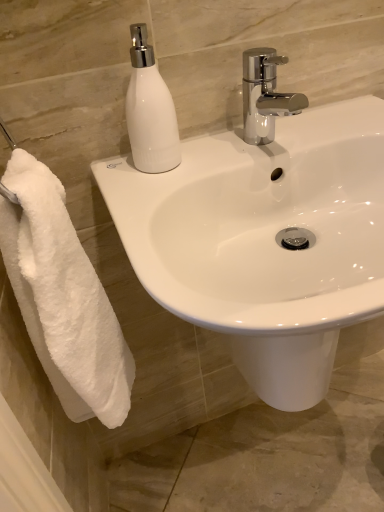
Question: Can white fluffy towel at left be found inside white glossy soap dispenser at upper left?

Choices:
 (A) no
 (B) yes

Answer: (A)

Question: Is white glossy soap dispenser at upper left thinner than white fluffy towel at left?

Choices:
 (A) no
 (B) yes

Answer: (B)

Question: Can you see white glossy soap dispenser at upper left touching white fluffy towel at left?

Choices:
 (A) yes
 (B) no

Answer: (B)

Question: Is white glossy soap dispenser at upper left aimed at white fluffy towel at left?

Choices:
 (A) no
 (B) yes

Answer: (A)

Question: Can you confirm if white glossy soap dispenser at upper left is shorter than white fluffy towel at left?

Choices:
 (A) no
 (B) yes

Answer: (B)

Question: Does point (127, 109) appear closer or farther from the camera than point (271, 48)?

Choices:
 (A) closer
 (B) farther

Answer: (A)

Question: Relative to chrome metallic faucet at upper center, is white glossy soap dispenser at upper left in front or behind?

Choices:
 (A) behind
 (B) front

Answer: (B)

Question: Considering the positions of white glossy soap dispenser at upper left and chrome metallic faucet at upper center in the image, is white glossy soap dispenser at upper left wider or thinner than chrome metallic faucet at upper center?

Choices:
 (A) wide
 (B) thin

Answer: (B)

Question: Looking at the image, does white glossy soap dispenser at upper left seem bigger or smaller compared to chrome metallic faucet at upper center?

Choices:
 (A) big
 (B) small

Answer: (B)

Question: Does point (180, 156) appear closer or farther from the camera than point (306, 137)?

Choices:
 (A) closer
 (B) farther

Answer: (A)

Question: Is white glossy soap dispenser at upper left spatially inside white glossy sink at center, or outside of it?

Choices:
 (A) inside
 (B) outside

Answer: (B)

Question: In terms of size, does white glossy soap dispenser at upper left appear bigger or smaller than white glossy sink at center?

Choices:
 (A) small
 (B) big

Answer: (A)

Question: Considering the positions of white glossy soap dispenser at upper left and white glossy sink at center in the image, is white glossy soap dispenser at upper left wider or thinner than white glossy sink at center?

Choices:
 (A) thin
 (B) wide

Answer: (A)

Question: Choose the correct answer: Is white glossy sink at center inside chrome metallic faucet at upper center or outside it?

Choices:
 (A) outside
 (B) inside

Answer: (A)

Question: From a real-world perspective, is white glossy sink at center above or below chrome metallic faucet at upper center?

Choices:
 (A) above
 (B) below

Answer: (B)